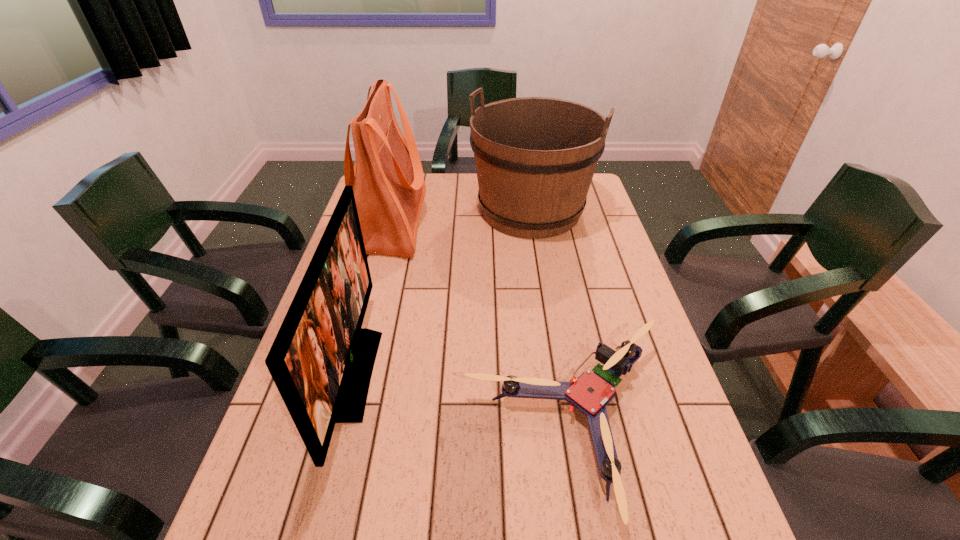
Select which object appears as the second closest to the monitor. Please provide its 2D coordinates. Your answer should be formatted as a tuple, i.e. [(x, y)], where the tuple contains the x and y coordinates of a point satisfying the conditions above.

[(590, 393)]

Locate an element on the screen. object that stands as the third closest to the bucket is located at coordinates (590, 393).